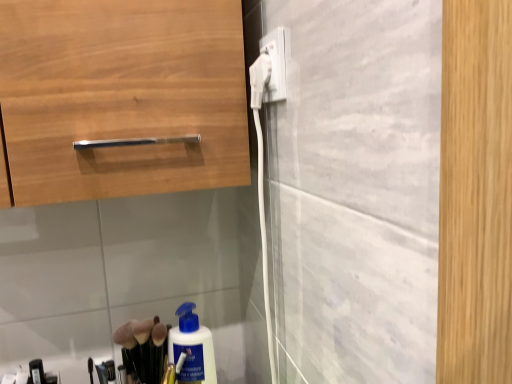
Question: From their relative heights in the image, would you say white plastic plug at upper center, placed as the 2th electric outlet when sorted from right to left, is taller or shorter than white plastic plug at upper center, the first electric outlet when ordered from right to left?

Choices:
 (A) tall
 (B) short

Answer: (B)

Question: Which is correct: white plastic plug at upper center, placed as the 2th electric outlet when sorted from right to left, is inside white plastic plug at upper center, the first electric outlet when ordered from right to left, or outside of it?

Choices:
 (A) inside
 (B) outside

Answer: (B)

Question: Looking at their shapes, would you say white plastic plug at upper center, placed as the 2th electric outlet when sorted from right to left, is wider or thinner than white plastic plug at upper center, the first electric outlet when ordered from right to left?

Choices:
 (A) thin
 (B) wide

Answer: (A)

Question: From a real-world perspective, is white plastic plug at upper center, which is the second electric outlet from left to right, positioned above or below white plastic plug at upper center, marked as the first electric outlet in a left-to-right arrangement?

Choices:
 (A) above
 (B) below

Answer: (A)

Question: Considering the positions of white plastic plug at upper center, the first electric outlet when ordered from right to left, and white plastic plug at upper center, placed as the 2th electric outlet when sorted from right to left, in the image, is white plastic plug at upper center, the first electric outlet when ordered from right to left, taller or shorter than white plastic plug at upper center, placed as the 2th electric outlet when sorted from right to left,?

Choices:
 (A) tall
 (B) short

Answer: (A)

Question: Considering the positions of point (276, 61) and point (257, 77), is point (276, 61) closer or farther from the camera than point (257, 77)?

Choices:
 (A) closer
 (B) farther

Answer: (A)

Question: Based on their positions, is white plastic plug at upper center, the first electric outlet when ordered from right to left, located to the left or right of white plastic plug at upper center, marked as the first electric outlet in a left-to-right arrangement?

Choices:
 (A) right
 (B) left

Answer: (A)